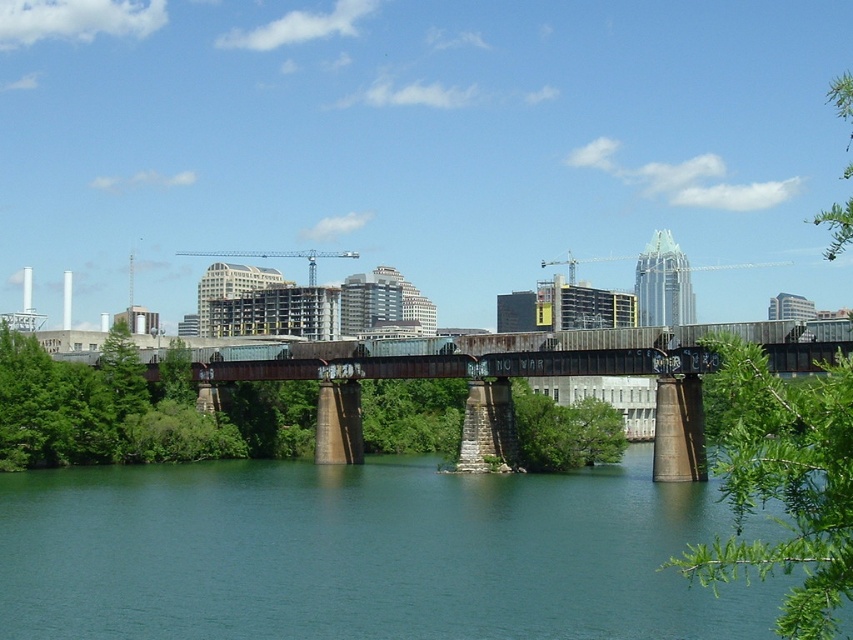
You are an architect designing a new park and need to place a small statue between the green smooth water at center and the green leafy tree at upper right. Which object should the statue be closer to if it needs to be placed closer to the narrower one?

The green smooth water at center is thinner than the green leafy tree at upper right, so the statue should be placed closer to the green smooth water at center.

You are standing at the point with coordinates point (822,468) and want to walk towards the point with coordinates point (486,492). Which direction should you move relative to your current position?

You should move downward because point (486,492) is behind point (822,468), meaning it is located below your current position.